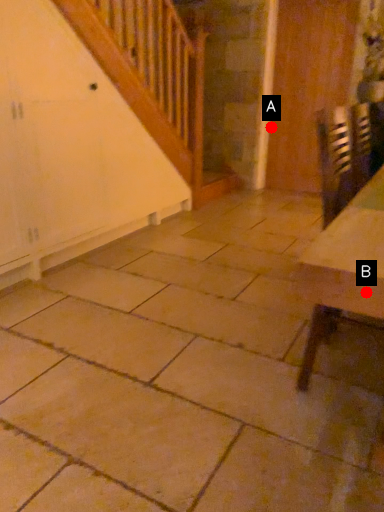
Question: Two points are circled on the image, labeled by A and B beside each circle. Which point is farther from the camera taking this photo?

Choices:
 (A) A is further
 (B) B is further

Answer: (A)